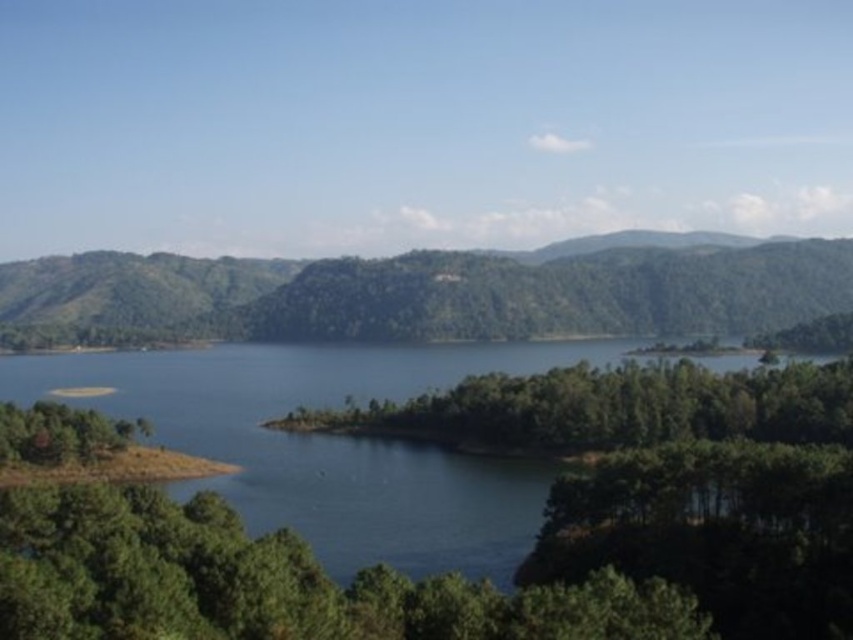
Question: Can you confirm if blue liquid water at center is positioned to the left of green forested mountain at center?

Choices:
 (A) yes
 (B) no

Answer: (B)

Question: Can you confirm if blue liquid water at center is positioned to the right of green forested mountain at center?

Choices:
 (A) yes
 (B) no

Answer: (A)

Question: Which point is farther to the camera?

Choices:
 (A) (375, 300)
 (B) (126, 355)

Answer: (A)

Question: Which point is closer to the camera taking this photo?

Choices:
 (A) (189, 486)
 (B) (106, 307)

Answer: (A)

Question: Is blue liquid water at center to the left of green forested mountain at center from the viewer's perspective?

Choices:
 (A) yes
 (B) no

Answer: (B)